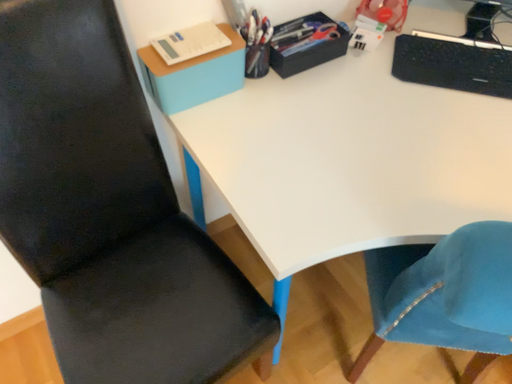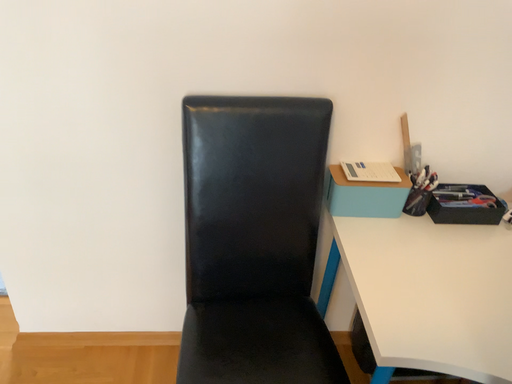
Question: How did the camera likely rotate when shooting the video?

Choices:
 (A) rotated right
 (B) rotated left

Answer: (B)